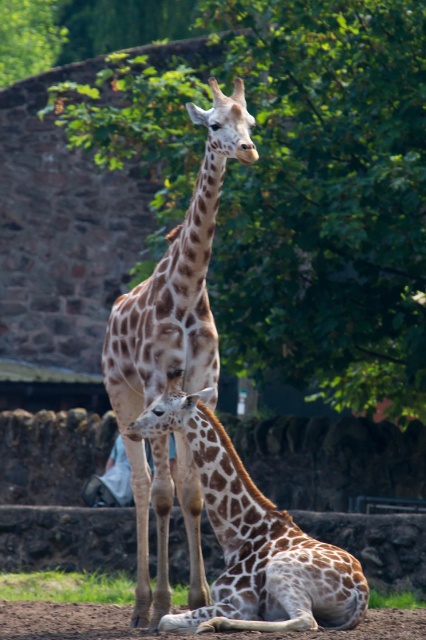
You are a zookeeper who needs to determine which giraffe requires a taller feeding platform. Based on the image, which giraffe between the spotted fur giraffe at center and the brown spotted giraffe at center is taller?

The spotted fur giraffe at center is much taller than the brown spotted giraffe at center, so the spotted fur giraffe at center requires a taller feeding platform.

You are standing in front of the enclosure and want to take a photo of the brown spotted giraffe at center without the brown sandy dirt at lower center appearing in the frame. Which direction should you move to achieve this?

Move to the left side of the enclosure to position the brown spotted giraffe at center to the right of the brown sandy dirt at lower center, thus excluding the dirt from the frame.